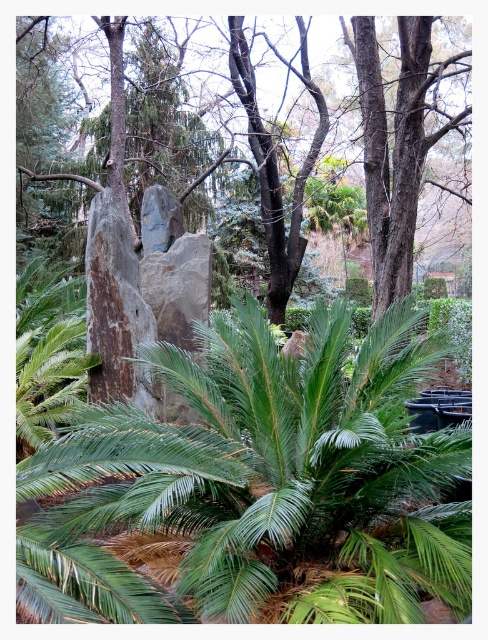
Question: Does green leafy palm at center appear on the right side of rough bark tree at center?

Choices:
 (A) no
 (B) yes

Answer: (A)

Question: Which point is farther to the camera?

Choices:
 (A) green leafy palm at center
 (B) rough bark tree at center

Answer: (B)

Question: Can you confirm if green leafy palm at center is positioned to the right of rough bark tree at center?

Choices:
 (A) yes
 (B) no

Answer: (B)

Question: Can you confirm if green leafy palm at center is bigger than rough bark tree at center?

Choices:
 (A) no
 (B) yes

Answer: (B)

Question: Which of the following is the farthest from the observer?

Choices:
 (A) (57, 512)
 (B) (40, 177)

Answer: (B)